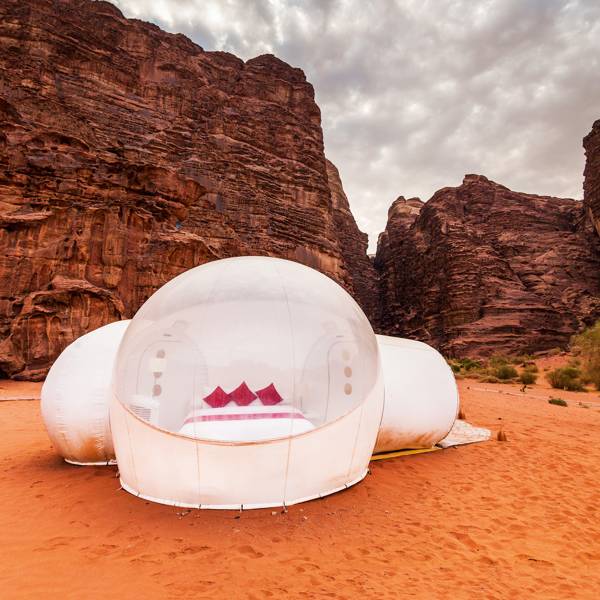
Locate an element on the screen. bed is located at coordinates (230, 428).